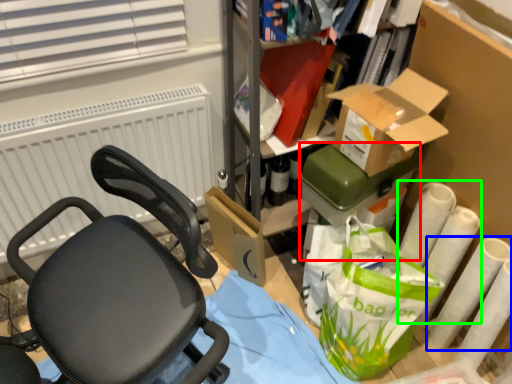
Question: Based on their relative distances, which object is farther from box (highlighted by a red box)? Choose from toilet paper (highlighted by a blue box) and toilet paper (highlighted by a green box).

Choices:
 (A) toilet paper
 (B) toilet paper

Answer: (A)